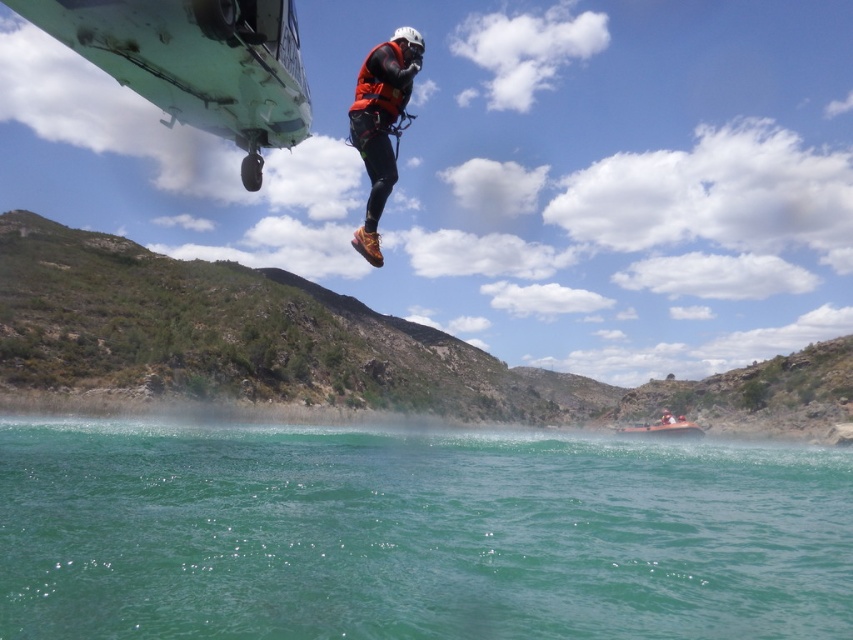
Question: Does green smooth water at lower center appear over orange matte life vest at center?

Choices:
 (A) no
 (B) yes

Answer: (A)

Question: Which object is the farthest from the orange matte life vest at center?

Choices:
 (A) orange matte life jacket at center
 (B) orange fabric helmet at upper center

Answer: (B)

Question: Among these points, which one is farthest from the camera?

Choices:
 (A) (374, 97)
 (B) (119, 461)

Answer: (B)

Question: Which point appears closest to the camera in this image?

Choices:
 (A) (274, 515)
 (B) (386, 96)
 (C) (370, 236)

Answer: (C)

Question: From the image, what is the correct spatial relationship of orange matte life jacket at center in relation to orange fabric helmet at upper center?

Choices:
 (A) below
 (B) above

Answer: (B)

Question: Is green smooth water at lower center to the right of orange fabric helmet at upper center from the viewer's perspective?

Choices:
 (A) yes
 (B) no

Answer: (B)